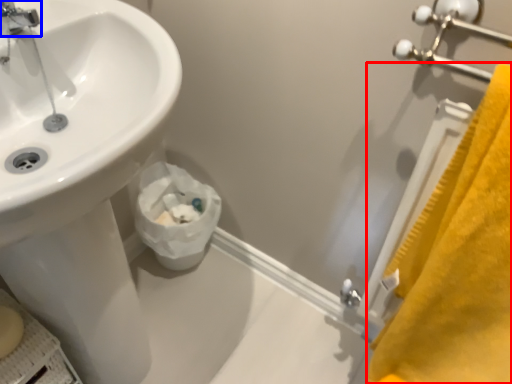
Question: Among these objects, which one is farthest to the camera, bath towel (highlighted by a red box) or tap (highlighted by a blue box)?

Choices:
 (A) bath towel
 (B) tap

Answer: (B)